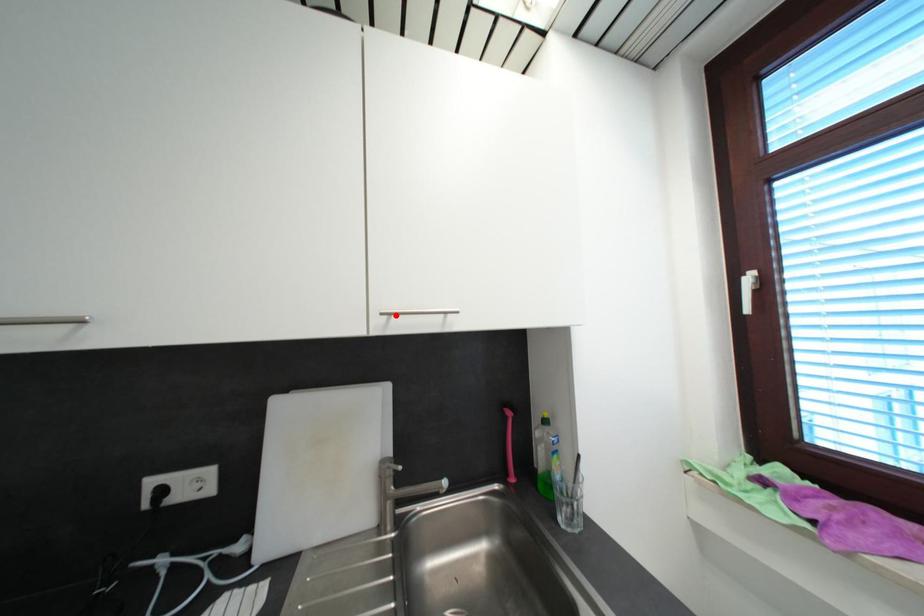
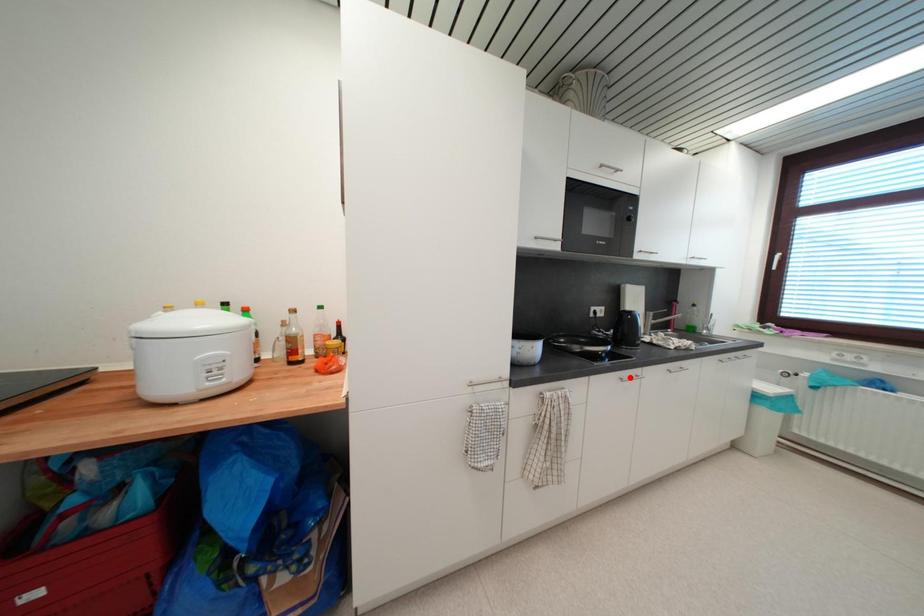
I am providing you with two images of the same scene from different viewpoints. A red point is marked on the first image and another point is marked on the second image. Are the points marked in image1 and image2 representing the same 3D position?

No